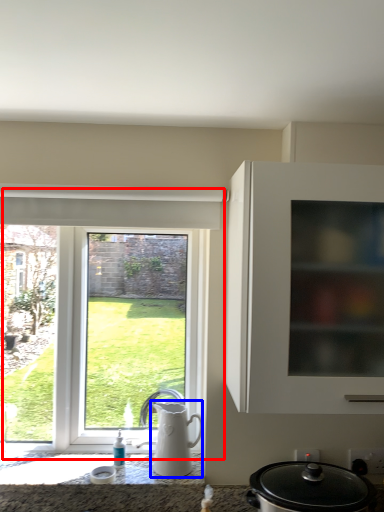
Question: Which object is closer to the camera taking this photo, window (highlighted by a red box) or jug (highlighted by a blue box)?

Choices:
 (A) window
 (B) jug

Answer: (B)